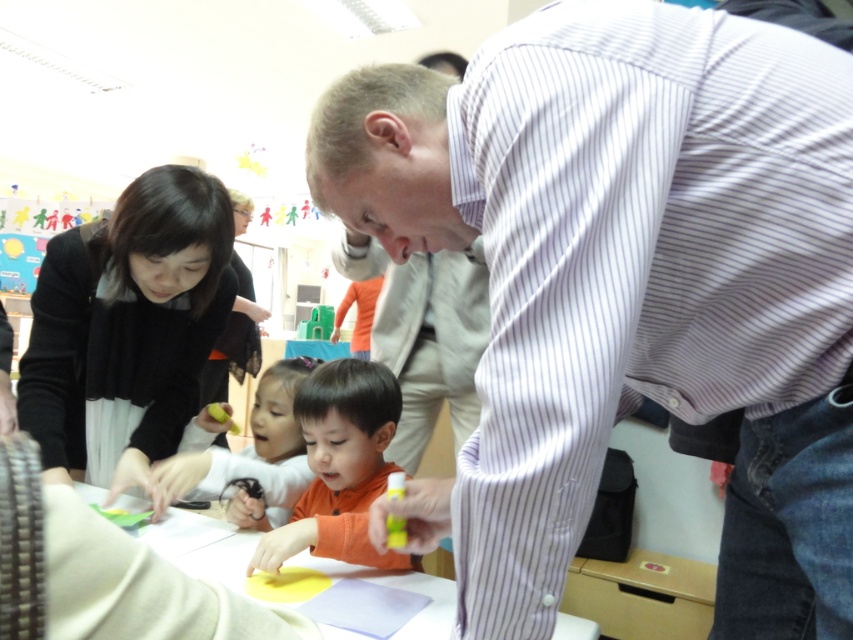
You are a teacher observing a classroom activity. You notice the smooth yellow paper at center and the smooth orange shirt at center. Which object is bigger in size?

The smooth yellow paper at center is larger in size compared to the smooth orange shirt at center.

Looking at this image, you are standing in front of the table where the man and child are working. There are two points marked on the table surface. The first point is at coordinates point[329,518] and the second is at point[267,452]. Which point is closer to you?

Point[329,518] is closer to the camera than point[267,452], so the first point is closer to you.

You are a photographer standing near the table. You want to take a photo of both the white striped shirt at upper right and the orange matte shirt at center. Since you can only focus on one person at a time, which person should you focus on to ensure the other is still in the frame?

You should focus on the white striped shirt at upper right because it is taller than the orange matte shirt at center, so keeping it in focus will likely keep the shorter one in the frame as well.